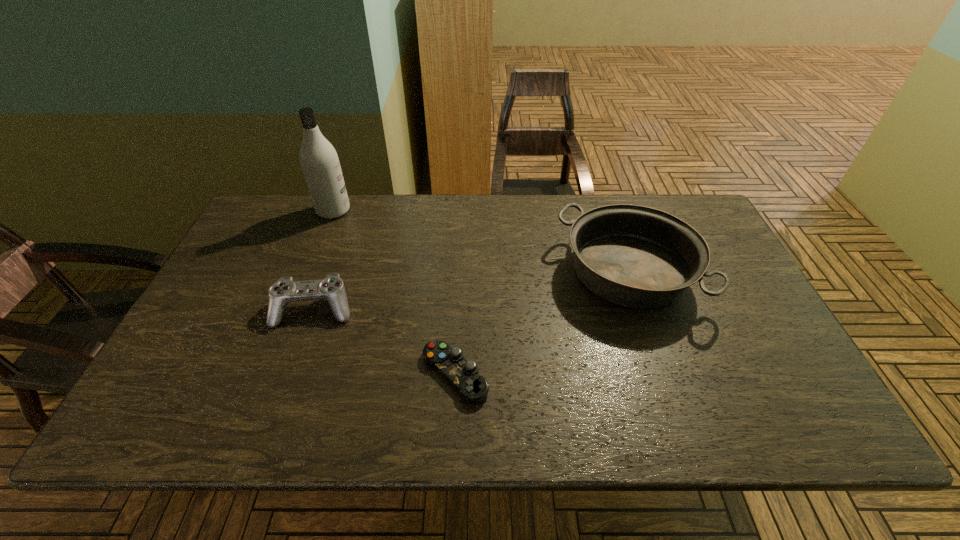
Locate an element on the screen. vacant point located 0.060m on the back of the farther control is located at coordinates (326, 274).

Where is `free space located on the right of the second object from right to left`? Image resolution: width=960 pixels, height=540 pixels. free space located on the right of the second object from right to left is located at coordinates (628, 374).

The height and width of the screenshot is (540, 960). What are the coordinates of `shampoo that is positioned at the far edge` in the screenshot? It's located at (320, 164).

I want to click on pan that is positioned at the far edge, so click(635, 256).

At what (x,y) coordinates should I click in order to perform the action: click on object present at the near edge. Please return your answer as a coordinate pair (x, y). Looking at the image, I should click on (473, 388).

At what (x,y) coordinates should I click in order to perform the action: click on object present at the right edge. Please return your answer as a coordinate pair (x, y). Looking at the image, I should click on (635, 256).

Where is `object located at the far right corner`? The height and width of the screenshot is (540, 960). object located at the far right corner is located at coordinates (635, 256).

Where is `vacant space at the far edge of the desktop`? The height and width of the screenshot is (540, 960). vacant space at the far edge of the desktop is located at coordinates (457, 239).

This screenshot has width=960, height=540. In order to click on free space at the near edge in this screenshot , I will do `click(311, 436)`.

Image resolution: width=960 pixels, height=540 pixels. Identify the location of vacant space at the right edge of the desktop. (731, 364).